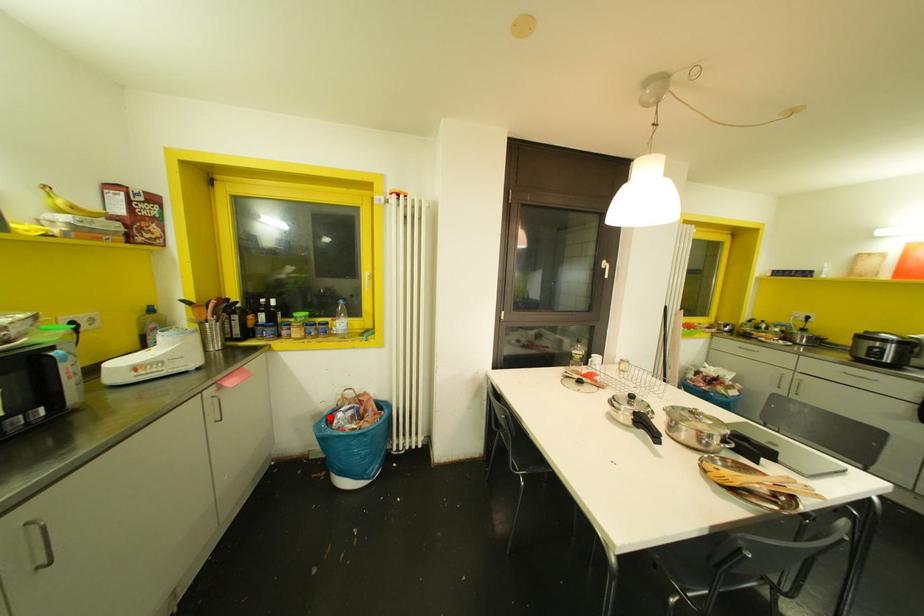
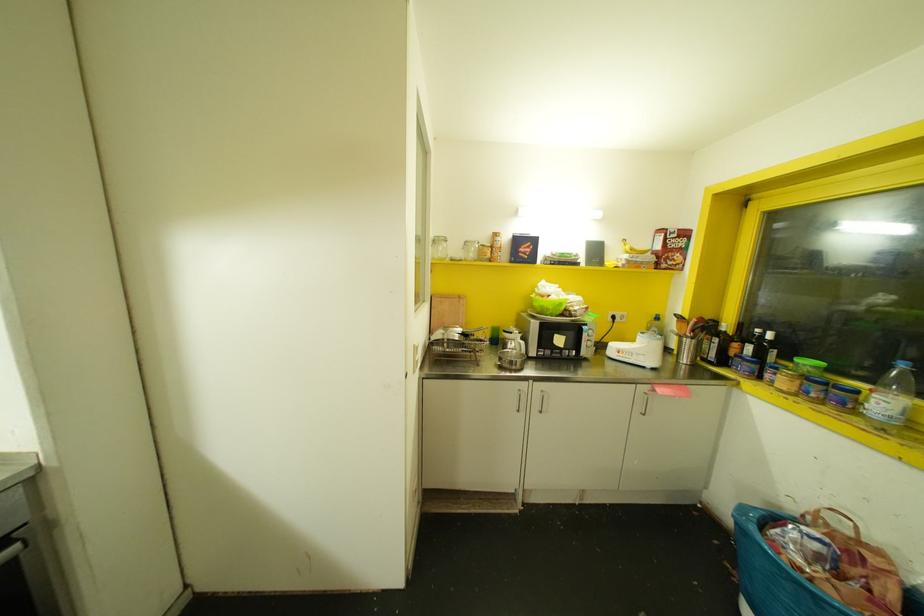
Locate, in the second image, the point that corresponds to the highlighted location in the first image.

(773, 517)